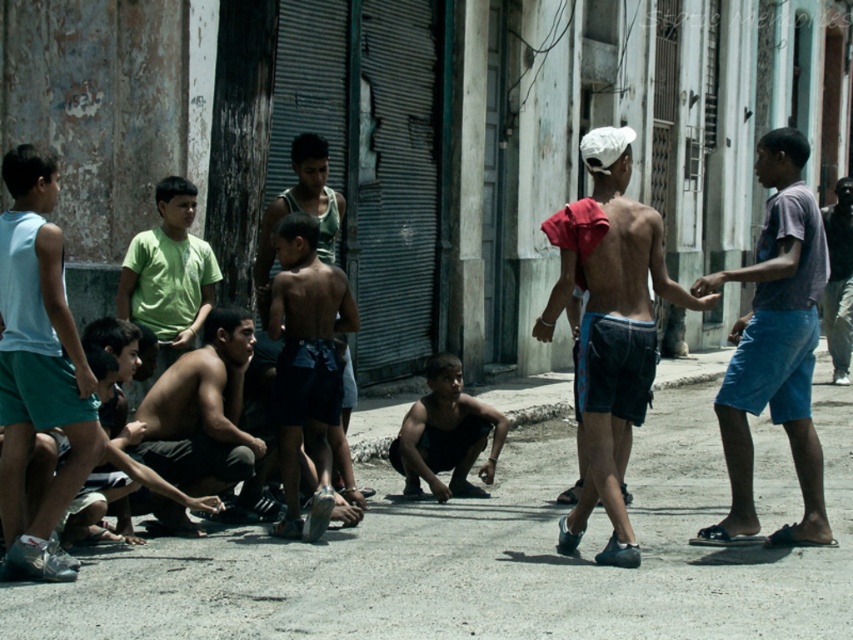
Question: Which of these objects is positioned closest to the shiny blue shorts at center?

Choices:
 (A) shiny black shorts at center
 (B) white matte shorts at left

Answer: (A)

Question: Does shiny blue shorts at center lie behind shiny black shorts at center?

Choices:
 (A) yes
 (B) no

Answer: (B)

Question: Which point appears farthest from the camera in this image?

Choices:
 (A) (810, 236)
 (B) (190, 403)

Answer: (B)

Question: Does shiny black shorts at center have a lesser width compared to dark blue jeans at center?

Choices:
 (A) no
 (B) yes

Answer: (A)

Question: Which is nearer to the black matte shirt at center?

Choices:
 (A) shiny blue shorts at center
 (B) white matte shorts at left

Answer: (A)

Question: Is shiny black shorts at center above black matte shirt at center?

Choices:
 (A) yes
 (B) no

Answer: (A)